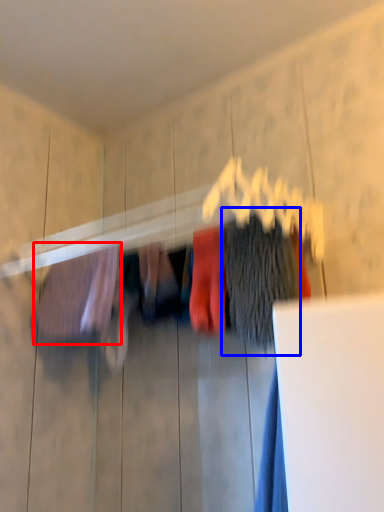
Question: Which of the following is the closest to the observer, clothing (highlighted by a red box) or clothing (highlighted by a blue box)?

Choices:
 (A) clothing
 (B) clothing

Answer: (B)